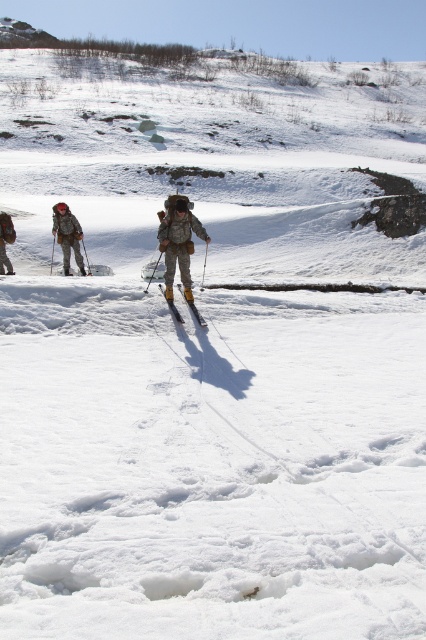
Is point (80, 252) positioned before point (0, 257)?

No.

Does camouflage fabric backpack at left have a lesser width compared to matte khaki pants at left?

Incorrect, camouflage fabric backpack at left's width is not less than matte khaki pants at left's.

This screenshot has width=426, height=640. Describe the element at coordinates (68, 236) in the screenshot. I see `camouflage fabric backpack at left` at that location.

Image resolution: width=426 pixels, height=640 pixels. In order to click on camouflage fabric backpack at left in this screenshot , I will do `click(68, 236)`.

Does camouflage fabric jacket at center appear on the right side of yellow metallic ski at center?

In fact, camouflage fabric jacket at center is to the left of yellow metallic ski at center.

Which of these two, camouflage fabric jacket at center or yellow metallic ski at center, stands taller?

camouflage fabric jacket at center is taller.

Which is behind, point (187, 282) or point (190, 307)?

The point (187, 282) is more distant.

Image resolution: width=426 pixels, height=640 pixels. I want to click on camouflage fabric jacket at center, so click(x=178, y=241).

Between matte khaki pants at left and yellow metallic ski at center, which one has less height?

Standing shorter between the two is yellow metallic ski at center.

Is point (3, 256) closer to camera compared to point (173, 314)?

No, (3, 256) is behind (173, 314).

I want to click on matte khaki pants at left, so click(5, 241).